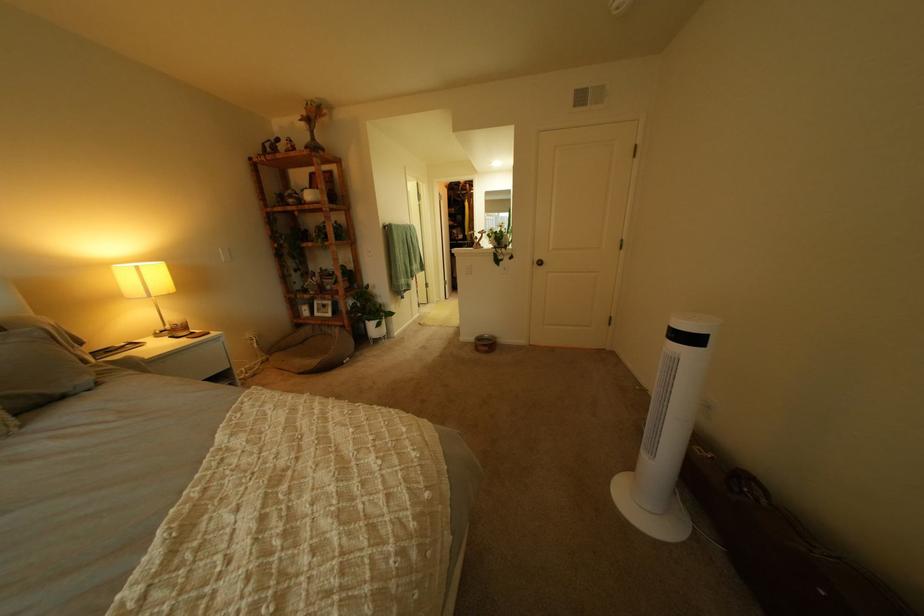
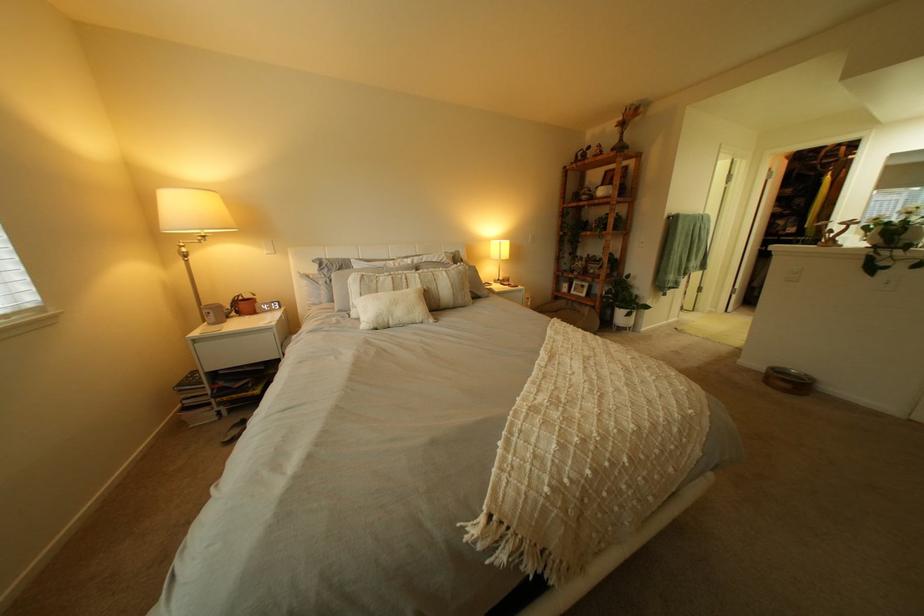
Question: The camera is either moving clockwise (left) or counter-clockwise (right) around the object. The first image is from the beginning of the video and the second image is from the end. Is the camera moving left or right when shooting the video?

Choices:
 (A) Left
 (B) Right

Answer: (B)